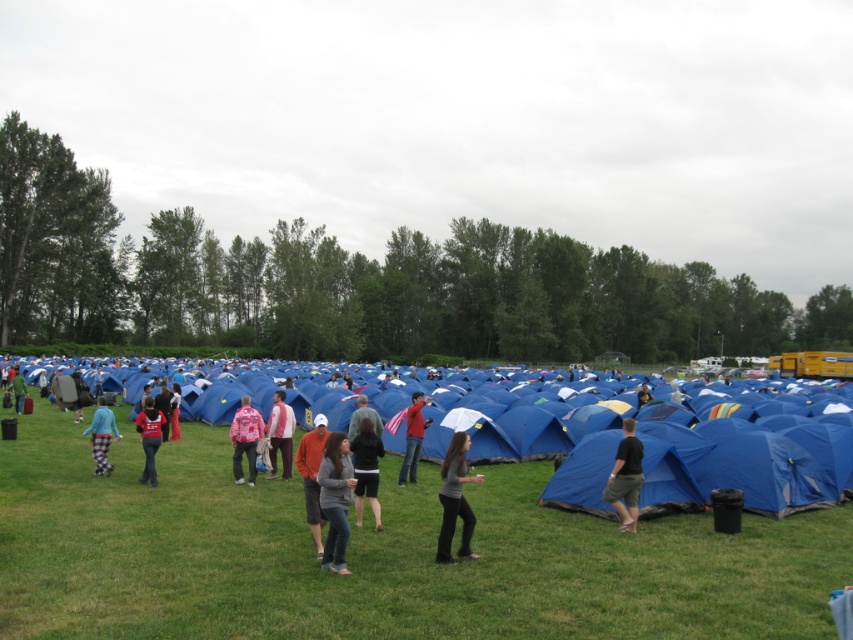
Does black cotton shorts at center have a lesser width compared to matte red shirt at center?

No, black cotton shorts at center is not thinner than matte red shirt at center.

Is black cotton shorts at center closer to the viewer compared to matte red shirt at center?

Yes, black cotton shorts at center is in front of matte red shirt at center.

Is point (627, 509) farther from camera compared to point (157, 449)?

No, (627, 509) is closer to viewer.

Find the location of a particular element. This screenshot has height=640, width=853. black cotton shorts at center is located at coordinates (625, 477).

This screenshot has width=853, height=640. Describe the element at coordinates (456, 499) in the screenshot. I see `dark gray fabric pants at center` at that location.

Between dark gray fabric pants at center and matte gray hoodie at center, which one is positioned higher?

matte gray hoodie at center is higher up.

Is point (444, 557) closer to viewer compared to point (375, 433)?

Yes, point (444, 557) is closer to viewer.

Find the location of a particular element. dark gray fabric pants at center is located at coordinates (456, 499).

Which is behind, point (379, 508) or point (252, 465)?

Positioned behind is point (252, 465).

From the picture: Who is shorter, black shorts at center or pink fabric jacket at center?

pink fabric jacket at center is shorter.

Is point (358, 496) behind point (252, 426)?

That is False.

Find the location of a particular element. black shorts at center is located at coordinates (366, 468).